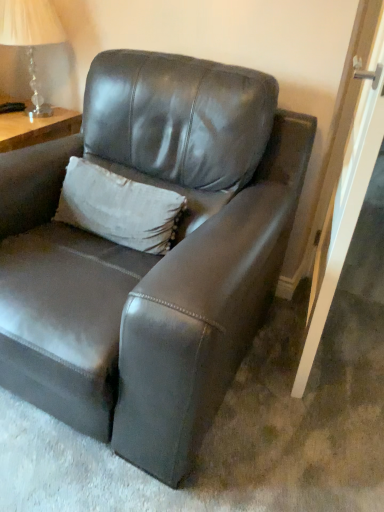
Question: Is white textured pillow at upper center smaller than clear glass lamp at upper left?

Choices:
 (A) yes
 (B) no

Answer: (A)

Question: Does white textured pillow at upper center have a larger size compared to clear glass lamp at upper left?

Choices:
 (A) no
 (B) yes

Answer: (A)

Question: Is white textured pillow at upper center wider than clear glass lamp at upper left?

Choices:
 (A) yes
 (B) no

Answer: (B)

Question: Considering the relative sizes of white textured pillow at upper center and clear glass lamp at upper left in the image provided, is white textured pillow at upper center shorter than clear glass lamp at upper left?

Choices:
 (A) yes
 (B) no

Answer: (A)

Question: From the image's perspective, is white textured pillow at upper center above clear glass lamp at upper left?

Choices:
 (A) yes
 (B) no

Answer: (B)

Question: From a real-world perspective, is matte leather couch at center above or below clear glass lamp at upper left?

Choices:
 (A) below
 (B) above

Answer: (A)

Question: Considering the positions of matte leather couch at center and clear glass lamp at upper left in the image, is matte leather couch at center wider or thinner than clear glass lamp at upper left?

Choices:
 (A) wide
 (B) thin

Answer: (A)

Question: In the image, is matte leather couch at center positioned in front of or behind clear glass lamp at upper left?

Choices:
 (A) front
 (B) behind

Answer: (A)

Question: Visually, is matte leather couch at center positioned to the left or to the right of clear glass lamp at upper left?

Choices:
 (A) right
 (B) left

Answer: (A)

Question: Is matte leather couch at center inside or outside of white textured pillow at upper center?

Choices:
 (A) outside
 (B) inside

Answer: (A)

Question: Considering the relative positions of matte leather couch at center and white textured pillow at upper center in the image provided, is matte leather couch at center to the left or to the right of white textured pillow at upper center?

Choices:
 (A) left
 (B) right

Answer: (B)

Question: Considering the positions of point (221, 311) and point (132, 202), is point (221, 311) closer or farther from the camera than point (132, 202)?

Choices:
 (A) farther
 (B) closer

Answer: (B)

Question: Considering the positions of matte leather couch at center and white textured pillow at upper center in the image, is matte leather couch at center bigger or smaller than white textured pillow at upper center?

Choices:
 (A) small
 (B) big

Answer: (B)

Question: Considering the positions of white textured pillow at upper center and matte leather couch at center in the image, is white textured pillow at upper center wider or thinner than matte leather couch at center?

Choices:
 (A) wide
 (B) thin

Answer: (B)

Question: Based on their sizes in the image, would you say white textured pillow at upper center is bigger or smaller than matte leather couch at center?

Choices:
 (A) small
 (B) big

Answer: (A)